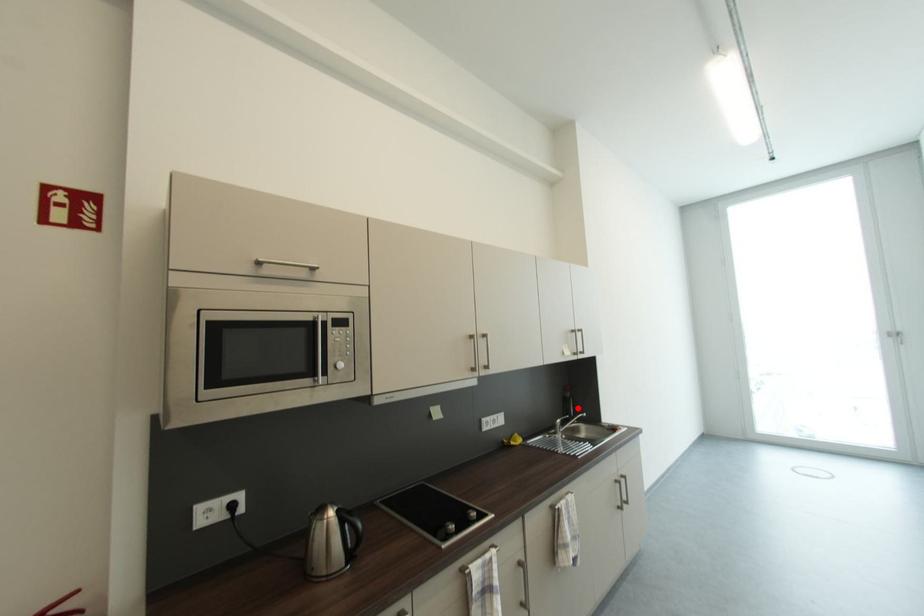
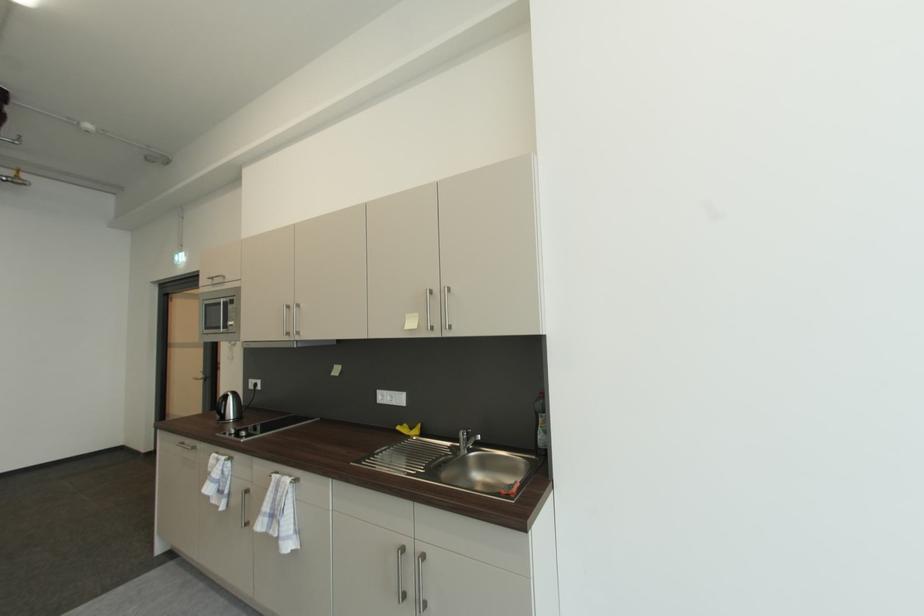
The point at the highlighted location is marked in the first image. Where is the corresponding point in the second image?

(545, 430)